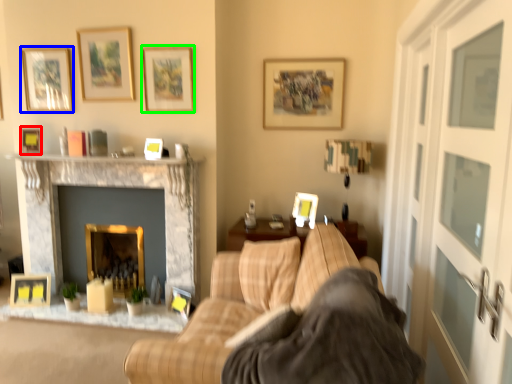
Question: Which object is positioned farthest from picture frame (highlighted by a red box)? Select from picture frame (highlighted by a blue box) and picture frame (highlighted by a green box).

Choices:
 (A) picture frame
 (B) picture frame

Answer: (B)